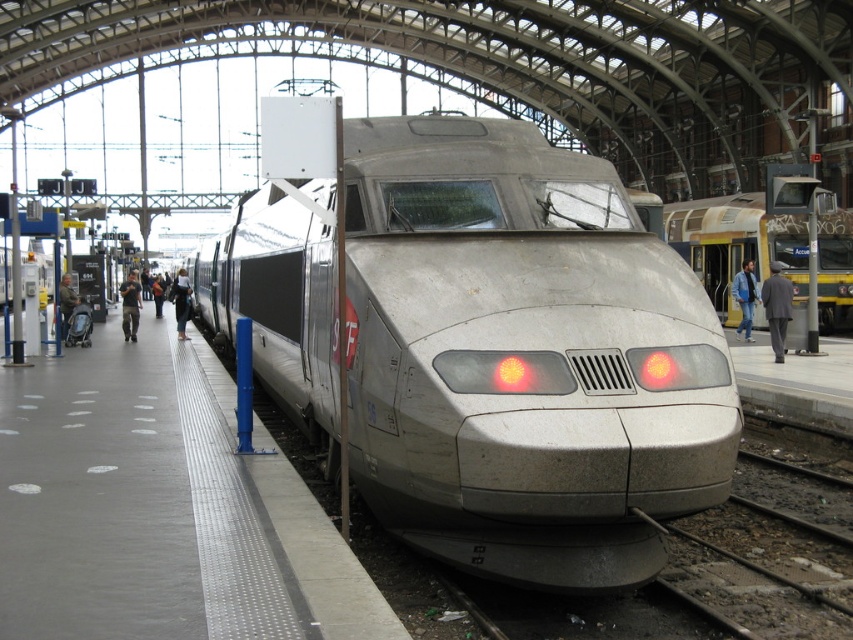
Image resolution: width=853 pixels, height=640 pixels. Describe the element at coordinates (160, 508) in the screenshot. I see `smooth concrete platform at center` at that location.

Does smooth concrete platform at center come in front of denim jacket at left?

Yes, smooth concrete platform at center is closer to the viewer.

The width and height of the screenshot is (853, 640). Describe the element at coordinates (160, 508) in the screenshot. I see `smooth concrete platform at center` at that location.

Where is `smooth concrete platform at center`? The width and height of the screenshot is (853, 640). smooth concrete platform at center is located at coordinates (160, 508).

Can you confirm if yellow metallic train at right is thinner than gray suit at right?

No, yellow metallic train at right is not thinner than gray suit at right.

Can you confirm if yellow metallic train at right is taller than gray suit at right?

Yes.

Locate an element on the screen. This screenshot has height=640, width=853. yellow metallic train at right is located at coordinates (735, 243).

Does point (720, 310) come closer to viewer compared to point (177, 305)?

No, (720, 310) is further to viewer.

Does yellow metallic train at right have a smaller size compared to black fabric coat at left?

Yes.

What do you see at coordinates (735, 243) in the screenshot? I see `yellow metallic train at right` at bounding box center [735, 243].

At what (x,y) coordinates should I click in order to perform the action: click on yellow metallic train at right. Please return your answer as a coordinate pair (x, y). The height and width of the screenshot is (640, 853). Looking at the image, I should click on (735, 243).